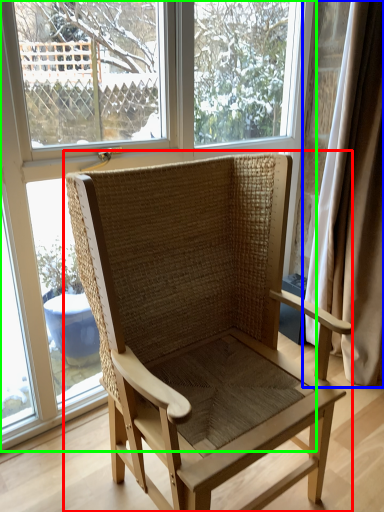
Question: Which object is positioned closest to chair (highlighted by a red box)? Select from curtain (highlighted by a blue box) and window (highlighted by a green box).

Choices:
 (A) curtain
 (B) window

Answer: (B)